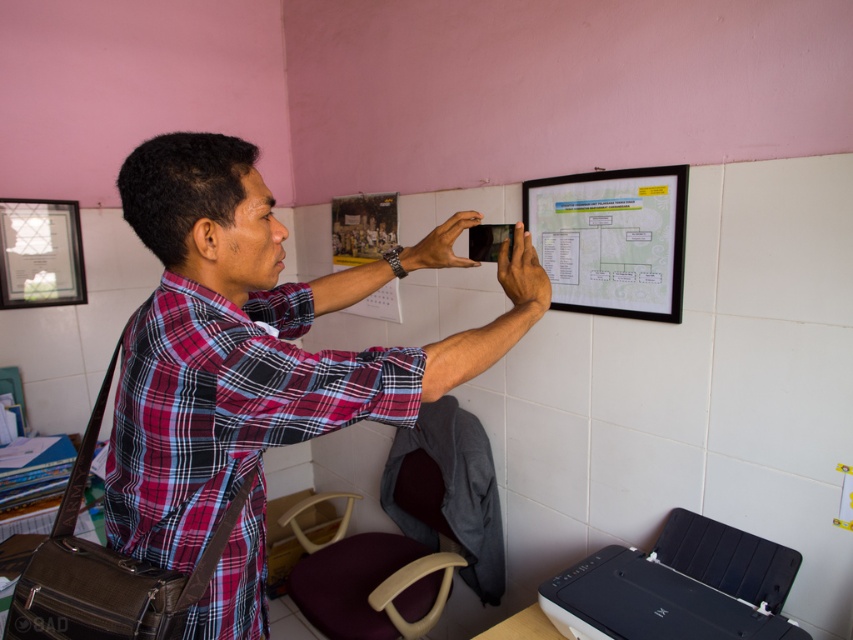
Is plaid shirt at center taller than black plastic printer at lower right?

Correct, plaid shirt at center is much taller as black plastic printer at lower right.

Can you confirm if plaid shirt at center is positioned to the right of black plastic printer at lower right?

No, plaid shirt at center is not to the right of black plastic printer at lower right.

Between point (447, 339) and point (712, 534), which one is positioned in front?

Point (447, 339)

Where is `plaid shirt at center`? This screenshot has height=640, width=853. plaid shirt at center is located at coordinates (256, 342).

Is plaid shirt at center below green matte bulletin board at upper center?

Indeed, plaid shirt at center is positioned under green matte bulletin board at upper center.

Does point (363, 376) come in front of point (589, 262)?

Yes, it is.

Where is `plaid shirt at center`? The width and height of the screenshot is (853, 640). plaid shirt at center is located at coordinates (256, 342).

Between point (577, 602) and point (613, 273), which one is positioned behind?

Point (613, 273)

This screenshot has height=640, width=853. What do you see at coordinates (677, 588) in the screenshot?
I see `black plastic printer at lower right` at bounding box center [677, 588].

The height and width of the screenshot is (640, 853). Identify the location of black plastic printer at lower right. (677, 588).